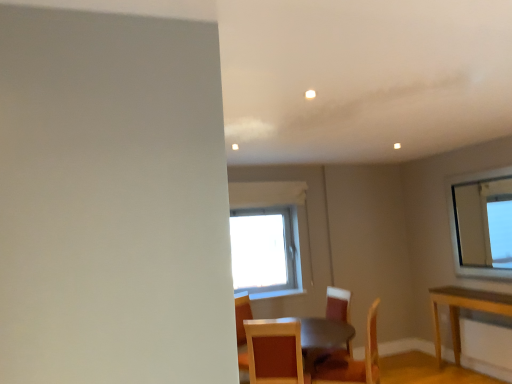
What do you see at coordinates (352, 361) in the screenshot? Image resolution: width=512 pixels, height=384 pixels. I see `wooden chair at center, which is counted as the 2th chair, starting from the back` at bounding box center [352, 361].

Image resolution: width=512 pixels, height=384 pixels. What do you see at coordinates (275, 351) in the screenshot?
I see `wooden textured chair at lower center, which is counted as the first chair, starting from the front` at bounding box center [275, 351].

This screenshot has width=512, height=384. Find the location of `wooden chair at center, which is counted as the 2th chair, starting from the back`. wooden chair at center, which is counted as the 2th chair, starting from the back is located at coordinates (352, 361).

Can you confirm if wooden chair at center, which appears as the 3th chair when viewed from the front, is taller than wooden chair at center, which is counted as the 2th chair, starting from the back?

Yes.

Would you say wooden chair at center, which is counted as the 2th chair, starting from the back, is part of wooden chair at center, which appears as the 3th chair when viewed from the front,'s contents?

No, wooden chair at center, which is counted as the 2th chair, starting from the back, is not a part of wooden chair at center, which appears as the 3th chair when viewed from the front.

Looking at this image, is wooden chair at center, which appears as the 3th chair when viewed from the front, oriented away from wooden chair at center, which is counted as the 2th chair, starting from the back?

No, wooden chair at center, which appears as the 3th chair when viewed from the front, is not facing away from wooden chair at center, which is counted as the 2th chair, starting from the back.

Considering the relative sizes of wooden textured chair at lower center, which is counted as the first chair, starting from the front, and wooden chair at center, which is counted as the 2th chair, starting from the back, in the image provided, is wooden textured chair at lower center, which is counted as the first chair, starting from the front, thinner than wooden chair at center, which is counted as the 2th chair, starting from the back,?

Incorrect, the width of wooden textured chair at lower center, which is counted as the first chair, starting from the front, is not less than that of wooden chair at center, which is counted as the 2th chair, starting from the back.

From the image's perspective, which is above, wooden textured chair at lower center, which is counted as the first chair, starting from the front, or wooden chair at center, marked as the 2th chair in a front-to-back arrangement?

wooden textured chair at lower center, which is counted as the first chair, starting from the front.

Which of these two, wooden textured chair at lower center, which is counted as the first chair, starting from the front, or wooden chair at center, which is counted as the 2th chair, starting from the back, is bigger?

With larger size is wooden chair at center, which is counted as the 2th chair, starting from the back.

Considering the relative positions of wooden textured chair at lower center, which is counted as the first chair, starting from the front, and wooden chair at center, marked as the 2th chair in a front-to-back arrangement, in the image provided, is wooden textured chair at lower center, which is counted as the first chair, starting from the front, to the left of wooden chair at center, marked as the 2th chair in a front-to-back arrangement, from the viewer's perspective?

Yes.

From the image's perspective, relative to wooden chair at center, which appears as the 3th chair when viewed from the front, is wooden chair at center, which is counted as the 2th chair, starting from the back, above or below?

Clearly, from the image's perspective, wooden chair at center, which is counted as the 2th chair, starting from the back, is above wooden chair at center, which appears as the 3th chair when viewed from the front.

Could you tell me if wooden chair at center, marked as the 2th chair in a front-to-back arrangement, is turned towards wooden chair at center, positioned as the 1th chair in back-to-front order?

No, wooden chair at center, marked as the 2th chair in a front-to-back arrangement, is not oriented towards wooden chair at center, positioned as the 1th chair in back-to-front order.

Would you say wooden chair at center, marked as the 2th chair in a front-to-back arrangement, is outside wooden chair at center, which appears as the 3th chair when viewed from the front?

wooden chair at center, marked as the 2th chair in a front-to-back arrangement, lies outside wooden chair at center, which appears as the 3th chair when viewed from the front,'s area.

From a real-world perspective, who is located lower, wooden chair at center, marked as the 2th chair in a front-to-back arrangement, or wooden chair at center, positioned as the 1th chair in back-to-front order?

In real-world perspective, wooden chair at center, positioned as the 1th chair in back-to-front order, is lower.

Is point (372, 335) positioned before point (264, 374)?

No, it is not.

Is wooden chair at center, marked as the 2th chair in a front-to-back arrangement, turned away from wooden textured chair at lower center, which is counted as the first chair, starting from the front?

wooden chair at center, marked as the 2th chair in a front-to-back arrangement, does not have its back to wooden textured chair at lower center, which is counted as the first chair, starting from the front.

Is wooden chair at center, which is counted as the 2th chair, starting from the back, positioned far away from wooden textured chair at lower center, arranged as the third chair when viewed from the back?

Actually, wooden chair at center, which is counted as the 2th chair, starting from the back, and wooden textured chair at lower center, arranged as the third chair when viewed from the back, are a little close together.

What's the angular difference between wooden chair at center, marked as the 2th chair in a front-to-back arrangement, and wooden textured chair at lower center, which is counted as the first chair, starting from the front,'s facing directions?

There is a 72.6-degree angle between the facing directions of wooden chair at center, marked as the 2th chair in a front-to-back arrangement, and wooden textured chair at lower center, which is counted as the first chair, starting from the front.

In the scene shown: Can you confirm if wooden chair at center, positioned as the 1th chair in back-to-front order, is taller than wooden textured chair at lower center, arranged as the third chair when viewed from the back?

Correct, wooden chair at center, positioned as the 1th chair in back-to-front order, is much taller as wooden textured chair at lower center, arranged as the third chair when viewed from the back.

Is wooden chair at center, positioned as the 1th chair in back-to-front order, next to wooden textured chair at lower center, arranged as the third chair when viewed from the back, and touching it?

No, wooden chair at center, positioned as the 1th chair in back-to-front order, is not touching wooden textured chair at lower center, arranged as the third chair when viewed from the back.

Between wooden chair at center, which appears as the 3th chair when viewed from the front, and wooden textured chair at lower center, arranged as the third chair when viewed from the back, which one has smaller size?

With smaller size is wooden textured chair at lower center, arranged as the third chair when viewed from the back.

Can you see wooden textured chair at lower center, which is counted as the first chair, starting from the front, touching wooden chair at center, positioned as the 1th chair in back-to-front order?

No.

Considering the relative positions of wooden textured chair at lower center, which is counted as the first chair, starting from the front, and wooden chair at center, which appears as the 3th chair when viewed from the front, in the image provided, is wooden textured chair at lower center, which is counted as the first chair, starting from the front, to the right of wooden chair at center, which appears as the 3th chair when viewed from the front, from the viewer's perspective?

No.

Looking at this image, which object is thinner, wooden textured chair at lower center, arranged as the third chair when viewed from the back, or wooden chair at center, which appears as the 3th chair when viewed from the front?

With smaller width is wooden chair at center, which appears as the 3th chair when viewed from the front.

Is wooden textured chair at lower center, which is counted as the first chair, starting from the front, looking in the opposite direction of wooden chair at center, positioned as the 1th chair in back-to-front order?

wooden textured chair at lower center, which is counted as the first chair, starting from the front, does not have its back to wooden chair at center, positioned as the 1th chair in back-to-front order.

You are a GUI agent. You are given a task and a screenshot of the screen. Output one action in this format:
    pyautogui.click(x=<x>, y=<y>)
    Task: Click on the chair lying below the wooden chair at center, which is counted as the 2th chair, starting from the back (from the image's perspective)
    
    Given the screenshot: What is the action you would take?
    pyautogui.click(x=337, y=304)

Which chair is the 1st one when counting from the back of the wooden textured chair at lower center, arranged as the third chair when viewed from the back? Please provide its 2D coordinates.

[(352, 361)]

Estimate the real-world distances between objects in this image. Which object is closer to wooden textured chair at lower center, arranged as the third chair when viewed from the back, wooden chair at center, which appears as the 3th chair when viewed from the front, or wooden chair at center, marked as the 2th chair in a front-to-back arrangement?

wooden chair at center, which appears as the 3th chair when viewed from the front, lies closer to wooden textured chair at lower center, arranged as the third chair when viewed from the back, than the other object.

Which object lies further to the anchor point wooden chair at center, which appears as the 3th chair when viewed from the front, wooden textured chair at lower center, which is counted as the first chair, starting from the front, or wooden chair at center, which is counted as the 2th chair, starting from the back?

Based on the image, wooden textured chair at lower center, which is counted as the first chair, starting from the front, appears to be further to wooden chair at center, which appears as the 3th chair when viewed from the front.

Estimate the real-world distances between objects in this image. Which object is closer to wooden chair at center, positioned as the 1th chair in back-to-front order, wooden chair at center, which is counted as the 2th chair, starting from the back, or wooden textured chair at lower center, which is counted as the first chair, starting from the front?

Among the two, wooden chair at center, which is counted as the 2th chair, starting from the back, is located nearer to wooden chair at center, positioned as the 1th chair in back-to-front order.

Estimate the real-world distances between objects in this image. Which object is closer to wooden chair at center, marked as the 2th chair in a front-to-back arrangement, wooden chair at center, which appears as the 3th chair when viewed from the front, or wooden textured chair at lower center, which is counted as the first chair, starting from the front?

wooden chair at center, which appears as the 3th chair when viewed from the front, is positioned closer to the anchor wooden chair at center, marked as the 2th chair in a front-to-back arrangement.

Which object lies nearer to the anchor point wooden textured chair at lower center, which is counted as the first chair, starting from the front, wooden chair at center, marked as the 2th chair in a front-to-back arrangement, or wooden chair at center, positioned as the 1th chair in back-to-front order?

wooden chair at center, positioned as the 1th chair in back-to-front order, is closer to wooden textured chair at lower center, which is counted as the first chair, starting from the front.

From the image, which object appears to be nearer to wooden chair at center, which is counted as the 2th chair, starting from the back, wooden textured chair at lower center, which is counted as the first chair, starting from the front, or wooden chair at center, positioned as the 1th chair in back-to-front order?

wooden chair at center, positioned as the 1th chair in back-to-front order.

Locate an element on the screen. This screenshot has width=512, height=384. chair between wooden textured chair at lower center, arranged as the third chair when viewed from the back, and wooden chair at center, which appears as the 3th chair when viewed from the front, in the front-back direction is located at coordinates (352, 361).